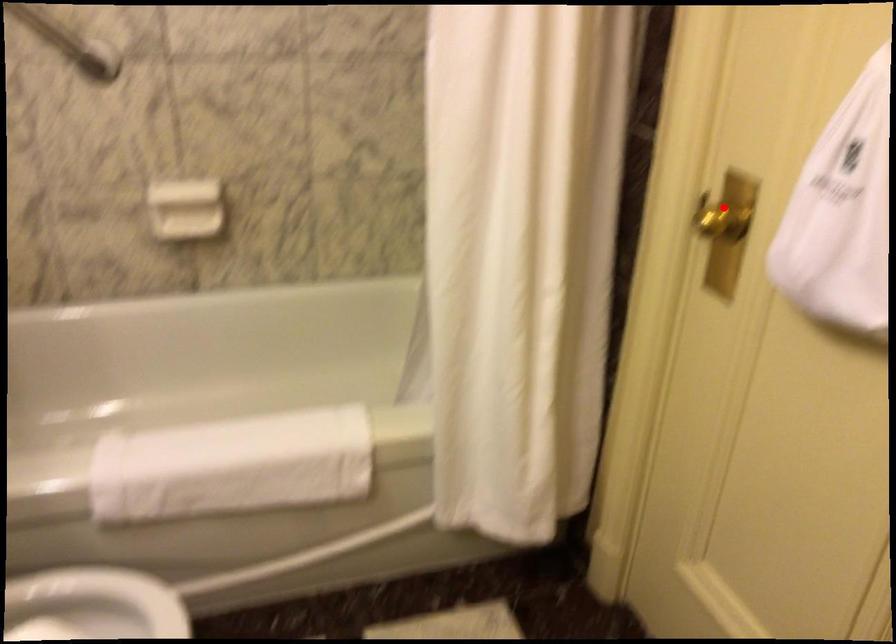
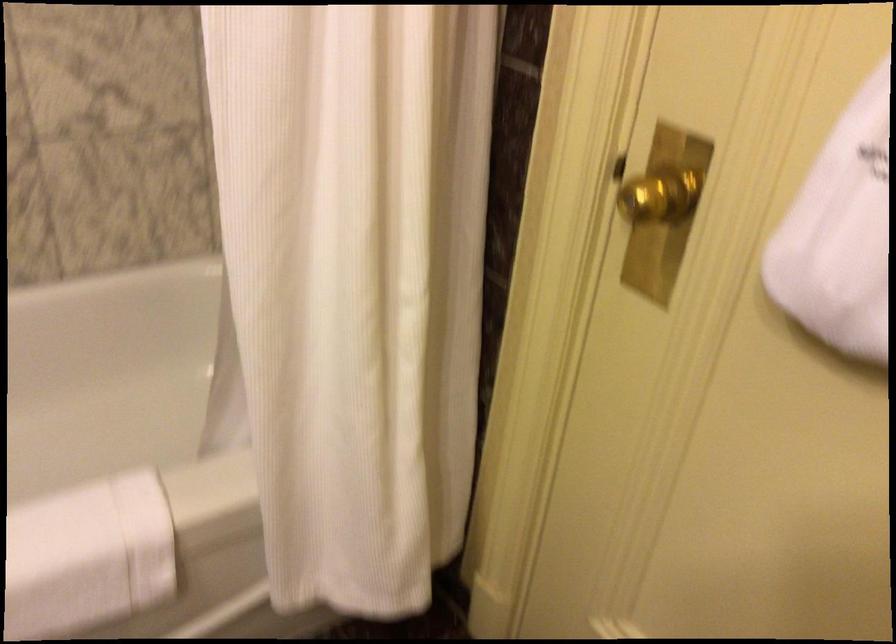
In the second image, find the point that corresponds to the highlighted location in the first image.

(657, 194)